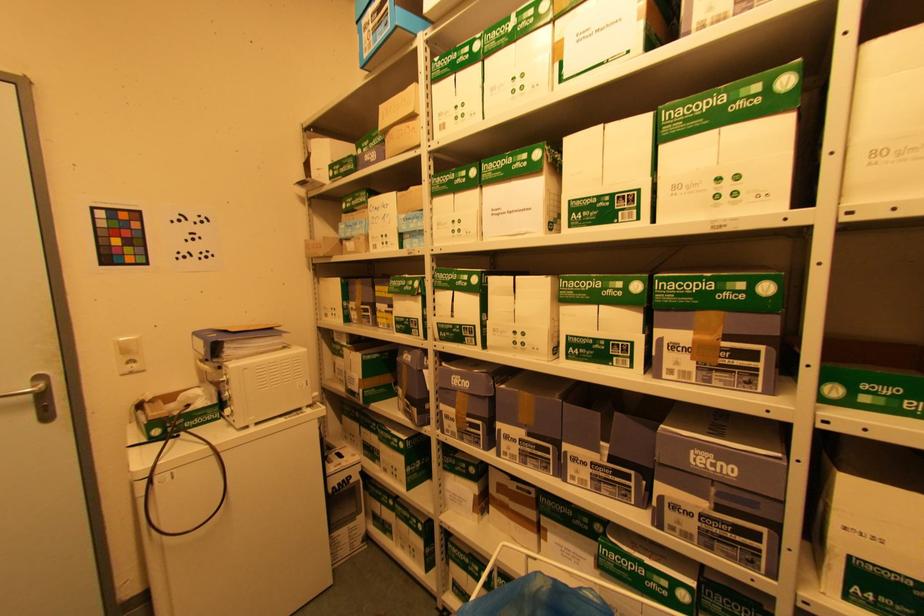
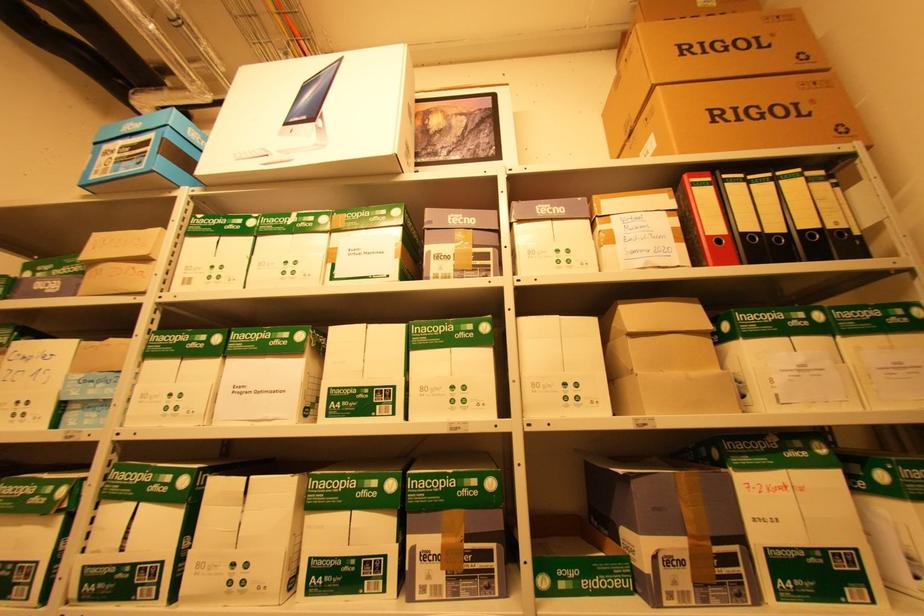
The images are taken continuously from a first-person perspective. In which direction is your viewpoint rotating?

The camera's rotation is toward right-up.